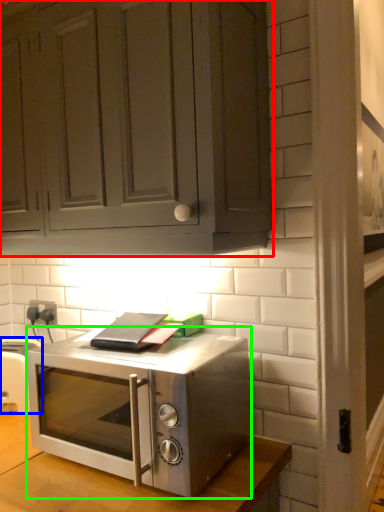
Question: Considering the real-world distances, which object is farthest from cabinetry (highlighted by a red box)? appliance (highlighted by a blue box) or microwave oven (highlighted by a green box)?

Choices:
 (A) appliance
 (B) microwave oven

Answer: (A)